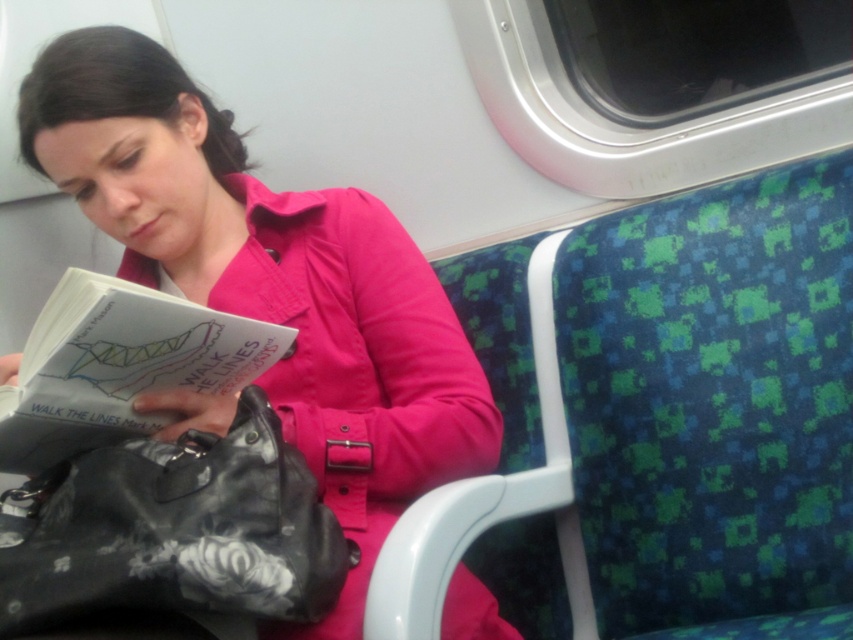
Question: Which point is closer to the camera?

Choices:
 (A) pink fabric jacket at center
 (B) white paper book at center
 (C) black leather bag at lower left

Answer: (C)

Question: Which point is closer to the camera?

Choices:
 (A) pink fabric jacket at center
 (B) white paper book at center

Answer: (B)

Question: Does pink fabric jacket at center appear under black leather bag at lower left?

Choices:
 (A) no
 (B) yes

Answer: (A)

Question: Which is nearer to the black leather bag at lower left?

Choices:
 (A) pink fabric jacket at center
 (B) white paper book at center

Answer: (B)

Question: Is black leather bag at lower left above white paper book at center?

Choices:
 (A) no
 (B) yes

Answer: (A)

Question: Does pink fabric jacket at center have a greater width compared to black leather bag at lower left?

Choices:
 (A) yes
 (B) no

Answer: (A)